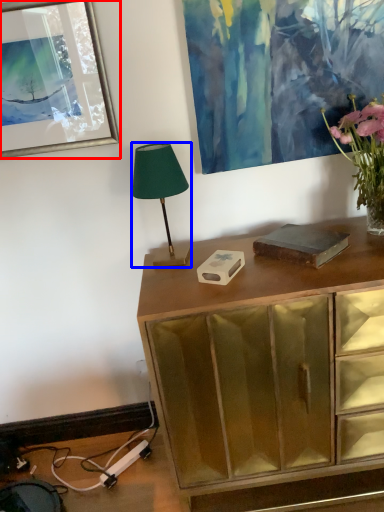
Question: Among these objects, which one is nearest to the camera, picture frame (highlighted by a red box) or lamp (highlighted by a blue box)?

Choices:
 (A) picture frame
 (B) lamp

Answer: (B)